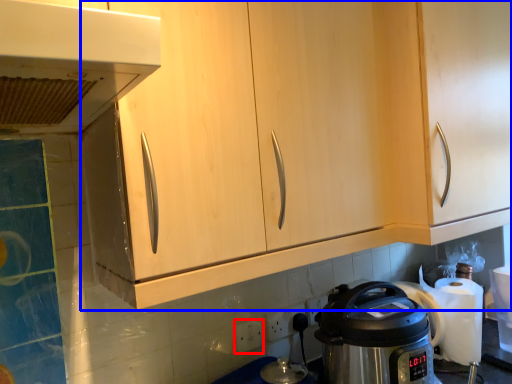
Question: Which object is closer to the camera taking this photo, electric outlet (highlighted by a red box) or cabinetry (highlighted by a blue box)?

Choices:
 (A) electric outlet
 (B) cabinetry

Answer: (B)